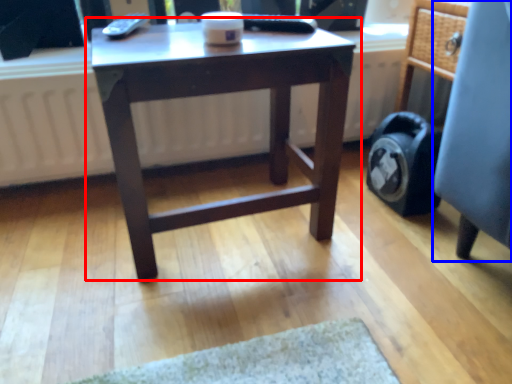
Question: Which point is further to the camera, table (highlighted by a red box) or computer chair (highlighted by a blue box)?

Choices:
 (A) table
 (B) computer chair

Answer: (B)